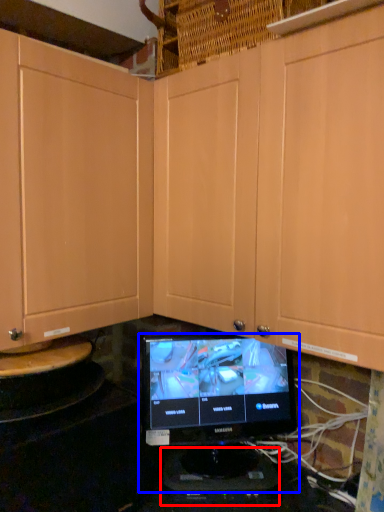
Question: Which of the following is the farthest to the observer, appliance (highlighted by a red box) or computer monitor (highlighted by a blue box)?

Choices:
 (A) appliance
 (B) computer monitor

Answer: (A)